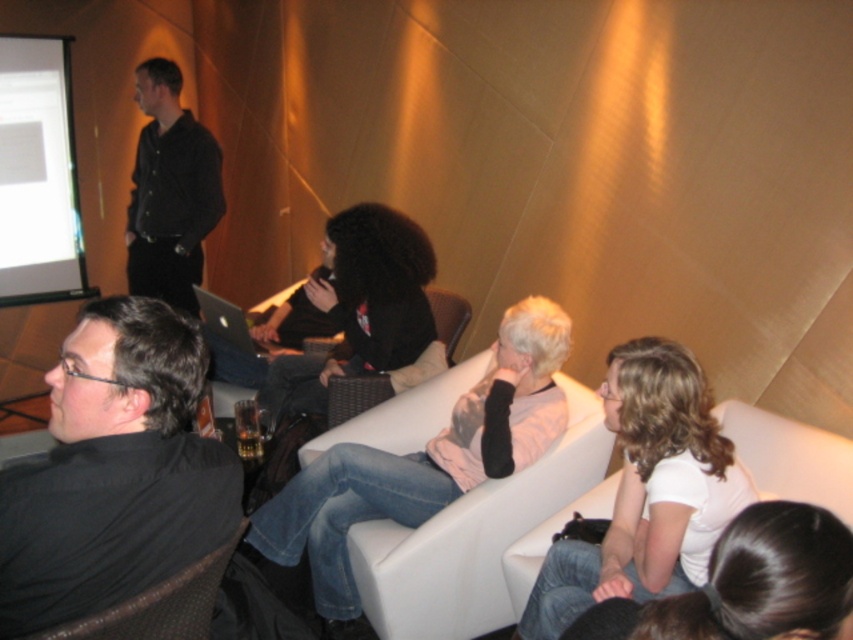
You are a photographer in the room and want to take a photo of both the white matte shirt at center and the black matte shirt at upper left. Which shirt should you focus on first if you want to ensure both are in focus?

Since the white matte shirt at center is shorter than the black matte shirt at upper left, you should focus on the black matte shirt at upper left first because it is farther away. This way, the depth of field will likely include both subjects in focus.

Where is the black matte shirt at center located in the image?

The black matte shirt at center is located at point (360,308) in the image.

You are a photographer setting up for a group photo in the room. You notice the black matte shirt at center and the woven wicker chair at center. Which object is covering the other?

The black matte shirt at center is positioned over the woven wicker chair at center, meaning the shirt is covering the chair in the image.